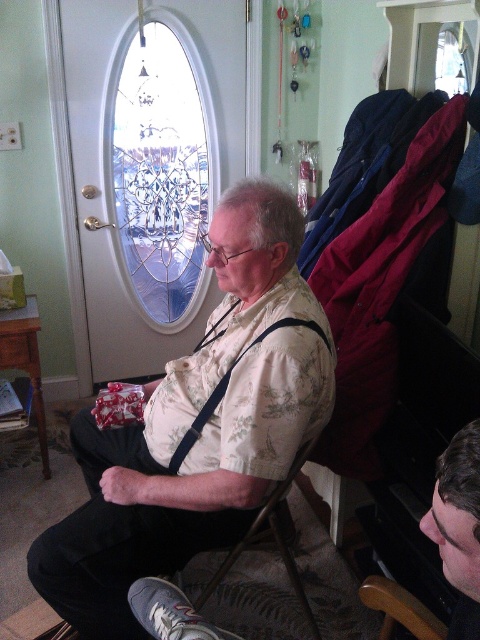
You are a tailor measuring for a new outfit. You need to determine which item requires a larger measurement tape between the floral shirt at center and the dark brown hair at lower right. Which one should you use the larger tape for?

The floral shirt at center requires the larger measurement tape because its width is greater than that of the dark brown hair at lower right.

From the picture: You are standing in the room and want to look out through the clear glass window at upper center. Based on your current position, where should you move to in order to have a clear view of the window?

To have a clear view of the clear glass window at upper center, you should move to a position where you can face the window directly. Since the window is located at point 0.264 on the horizontal axis and 0.335 on the vertical axis, positioning yourself centrally in the room and facing towards the upper center area would allow you to see it without obstruction.